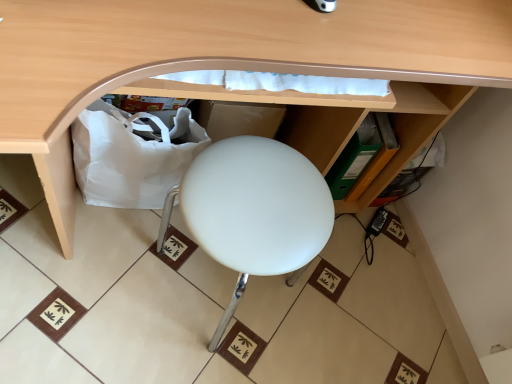
Where is `space that is in front of white matte stool at center`? This screenshot has width=512, height=384. space that is in front of white matte stool at center is located at coordinates (152, 356).